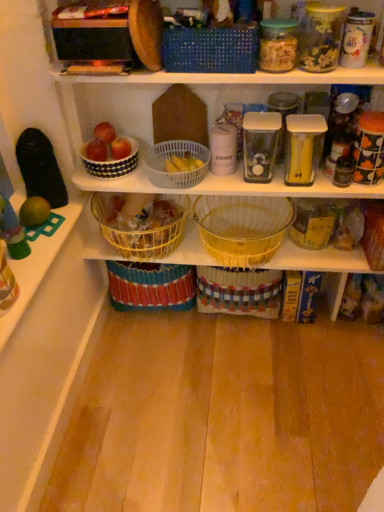
This screenshot has width=384, height=512. I want to click on empty space that is ontop of yellow wicker basket at center, so 263,238.